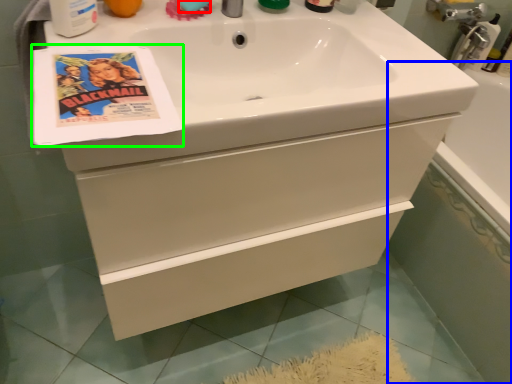
Question: Considering the real-world distances, which object is farthest from soap (highlighted by a red box)? bath (highlighted by a blue box) or flyer (highlighted by a green box)?

Choices:
 (A) bath
 (B) flyer

Answer: (A)